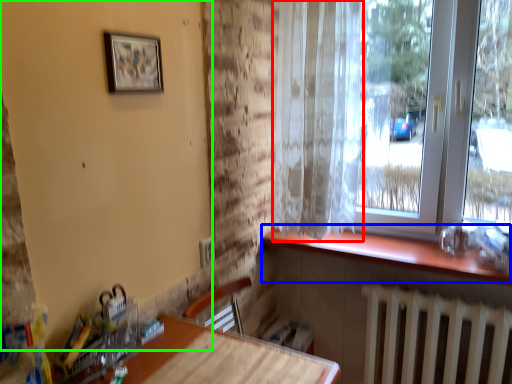
Question: Which object is positioned closest to curtain (highlighted by a red box)? Select from window sill (highlighted by a blue box) and backdrop (highlighted by a green box).

Choices:
 (A) window sill
 (B) backdrop

Answer: (A)